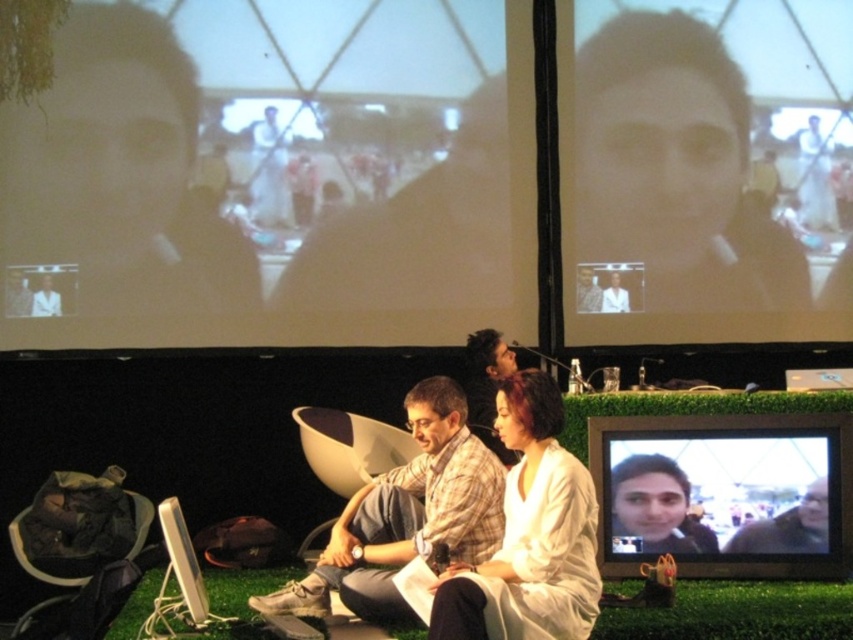
Question: Which object appears closest to the camera in this image?

Choices:
 (A) matte black screen at upper center
 (B) matte black laptop at center

Answer: (B)

Question: Is smooth brown hair at center positioned at the back of matte white shirt at center?

Choices:
 (A) yes
 (B) no

Answer: (B)

Question: Which point is farther from the camera taking this photo?

Choices:
 (A) (56, 300)
 (B) (602, 291)
 (C) (770, 548)

Answer: (B)

Question: In this image, where is plaid fabric shirt at center located relative to green grass at lower center?

Choices:
 (A) right
 (B) left

Answer: (B)

Question: Among these objects, which one is farthest from the camera?

Choices:
 (A) matte black monitor at center
 (B) matte black screen at upper center

Answer: (B)

Question: Can you confirm if matte black monitor at center is bigger than matte black laptop at center?

Choices:
 (A) no
 (B) yes

Answer: (B)